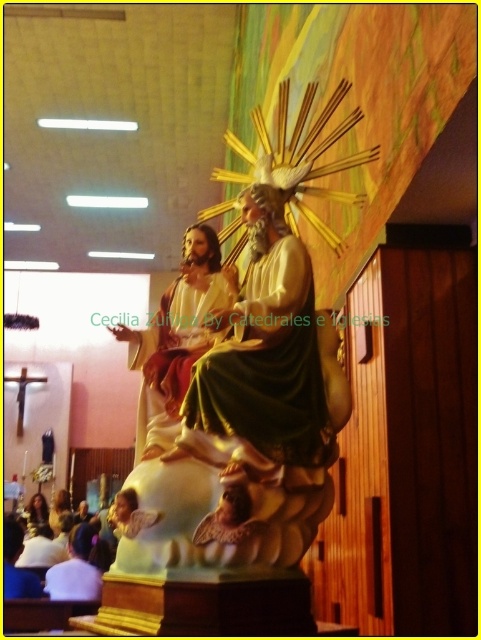
Question: Where is matte gold statue at center located in relation to white fabric shirt at lower left in the image?

Choices:
 (A) left
 (B) right

Answer: (B)

Question: Which of the following is the closest to the observer?

Choices:
 (A) matte gold statue at center
 (B) white fabric shirt at lower left
 (C) gold textured statue at center

Answer: (C)

Question: Which object is closer to the camera taking this photo?

Choices:
 (A) gold textured statue at center
 (B) white fabric shirt at lower left
 (C) matte gold statue at center

Answer: (A)

Question: Is gold textured statue at center above matte gold statue at center?

Choices:
 (A) yes
 (B) no

Answer: (A)

Question: Which point appears farthest from the camera in this image?

Choices:
 (A) (79, 593)
 (B) (265, 406)
 (C) (203, 230)

Answer: (A)

Question: Can you confirm if matte gold statue at center is positioned to the left of white fabric shirt at lower left?

Choices:
 (A) yes
 (B) no

Answer: (B)